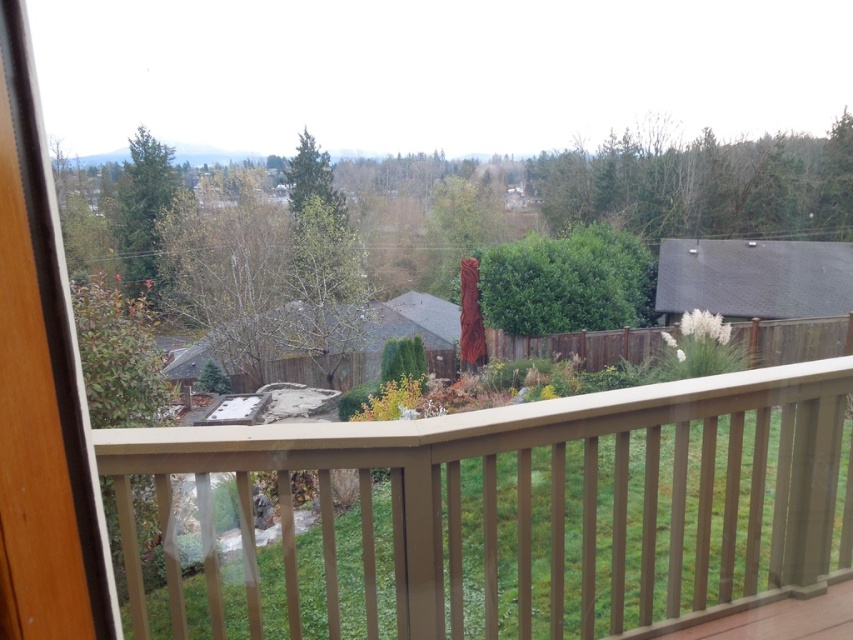
Can you confirm if brown wooden screen door at left is positioned to the right of green leafy tree at upper right?

In fact, brown wooden screen door at left is to the left of green leafy tree at upper right.

Who is more forward, (12, 609) or (535, 157)?

Point (12, 609) is in front.

Who is more distant from viewer, (25, 576) or (686, 154)?

The point (686, 154) is behind.

Identify the location of brown wooden screen door at left. (41, 390).

Who is more distant from viewer, (671, 566) or (169, 156)?

Positioned behind is point (169, 156).

Is point (578, 616) less distant than point (144, 284)?

That is True.

Find the location of a particular element. The image size is (853, 640). brown wood railing at lower center is located at coordinates (509, 513).

Find the location of `brown wood railing at lower center`. brown wood railing at lower center is located at coordinates (509, 513).

Between green leafy tree at upper right and green matte tree at upper left, which one is positioned lower?

green matte tree at upper left

Who is higher up, green leafy tree at upper right or green matte tree at upper left?

green leafy tree at upper right

At what (x,y) coordinates should I click in order to perform the action: click on green leafy tree at upper right. Please return your answer as a coordinate pair (x, y). This screenshot has width=853, height=640. Looking at the image, I should click on (704, 186).